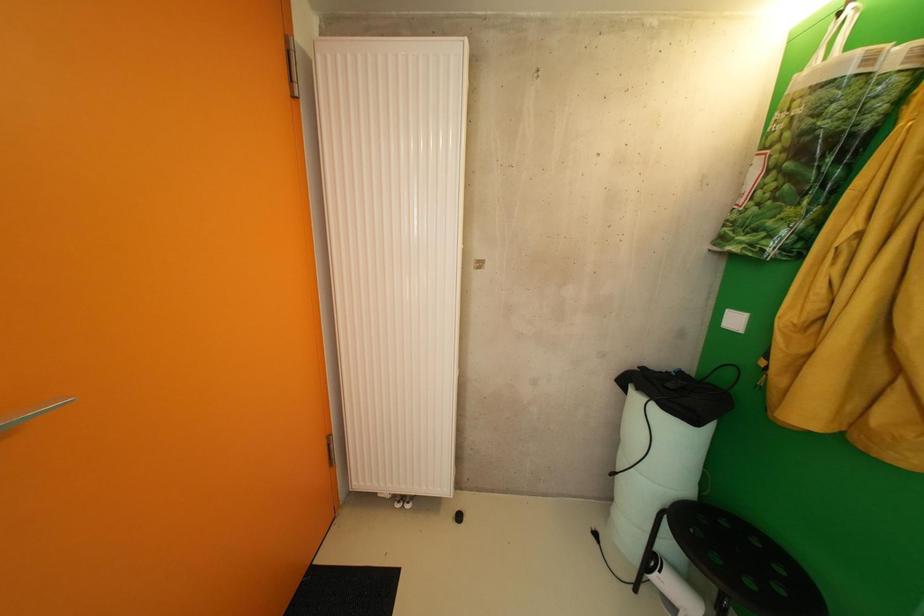
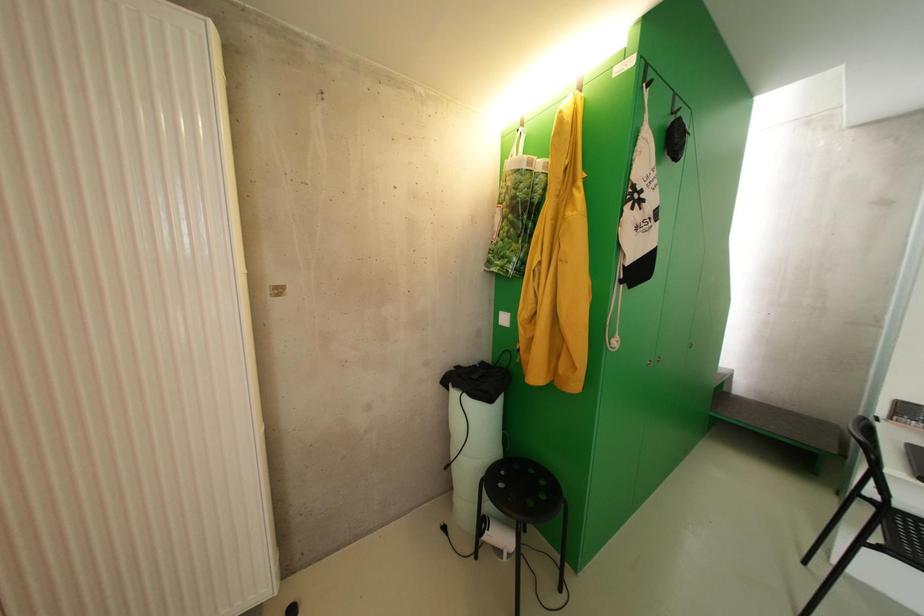
Question: The camera is either moving clockwise (left) or counter-clockwise (right) around the object. The first image is from the beginning of the video and the second image is from the end. Is the camera moving left or right when shooting the video?

Choices:
 (A) Left
 (B) Right

Answer: (A)